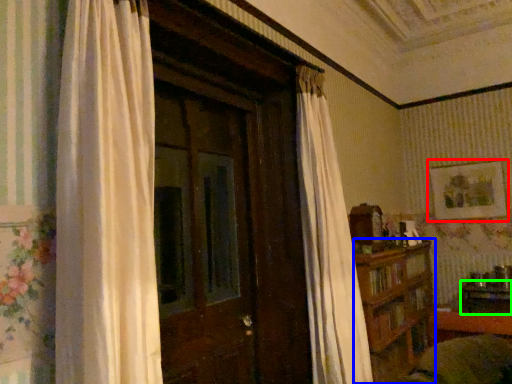
Question: Which is nearer to the picture frame (highlighted by a red box)? furniture (highlighted by a blue box) or table (highlighted by a green box).

Choices:
 (A) furniture
 (B) table

Answer: (B)